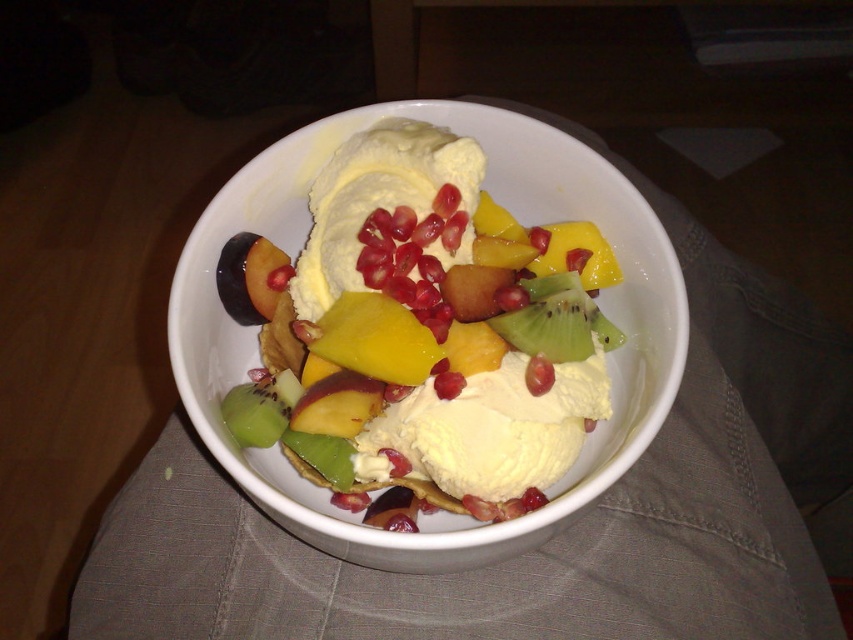
You are a food stylist arranging a fruit salad. You have a green matte kiwi at center and a red glossy pomegranate at center. Which fruit should you choose to place in a spot that requires a bigger piece?

The green matte kiwi at center has a larger size compared to the red glossy pomegranate at center, so you should choose the green matte kiwi at center for the spot that requires a bigger piece.

You are at a picnic and want to grab the red glossy pomegranate at center first. Which direction should you move your hand to reach it from the green matte kiwi at center?

The red glossy pomegranate at center is to the left of the green matte kiwi at center, so you should move your hand to the left to reach it.